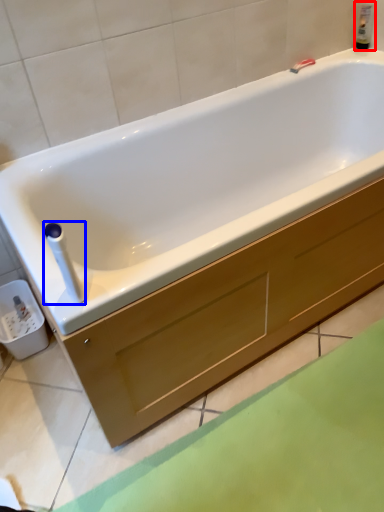
Question: Which of the following is the closest to the observer, bottle (highlighted by a red box) or towel bar (highlighted by a blue box)?

Choices:
 (A) bottle
 (B) towel bar

Answer: (B)